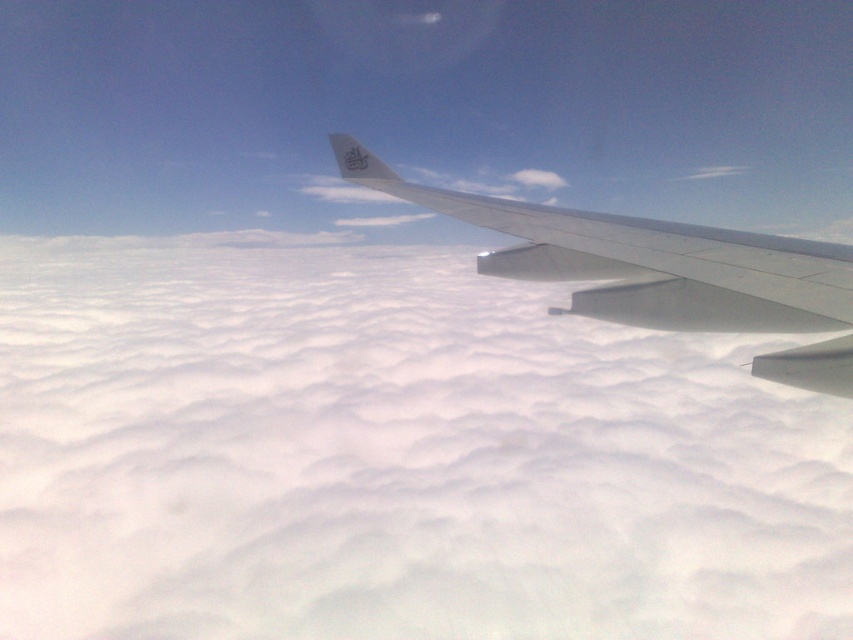
Question: Does white fluffy cloud at upper center appear over metallic gray wing at center?

Choices:
 (A) yes
 (B) no

Answer: (B)

Question: Is white fluffy cloud at upper center further to the viewer compared to metallic gray wing at center?

Choices:
 (A) yes
 (B) no

Answer: (A)

Question: Can you confirm if white fluffy cloud at upper center is smaller than metallic gray wing at center?

Choices:
 (A) no
 (B) yes

Answer: (A)